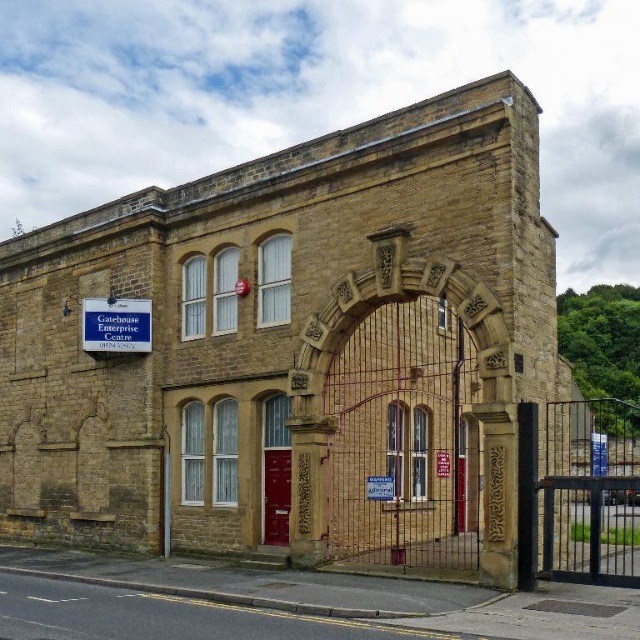
Question: Based on their relative distances, which object is nearer to the blue plastic sign at upper left?

Choices:
 (A) red plastic sign at center
 (B) white plastic sign at center

Answer: (B)

Question: Which is farther from the blue plastic sign at upper left?

Choices:
 (A) red plastic sign at center
 (B) white plastic sign at center

Answer: (A)

Question: Considering the relative positions of white plastic sign at center and red plastic sign at center in the image provided, where is white plastic sign at center located with respect to red plastic sign at center?

Choices:
 (A) above
 (B) below

Answer: (A)

Question: From the image, what is the correct spatial relationship of white plastic sign at center in relation to red plastic sign at center?

Choices:
 (A) above
 (B) below

Answer: (A)

Question: Which of these objects is positioned farthest from the red plastic sign at center?

Choices:
 (A) blue plastic sign at upper left
 (B) white plastic sign at center

Answer: (A)

Question: From the image, what is the correct spatial relationship of white plastic sign at center in relation to red plastic sign at center?

Choices:
 (A) left
 (B) right

Answer: (A)